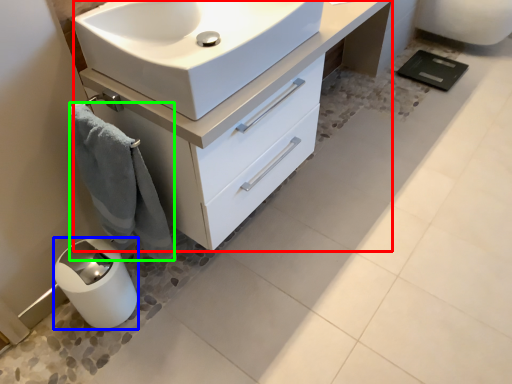
Question: Based on their relative distances, which object is nearer to bathroom cabinet (highlighted by a red box)? Choose from appliance (highlighted by a blue box) and bath towel (highlighted by a green box).

Choices:
 (A) appliance
 (B) bath towel

Answer: (B)